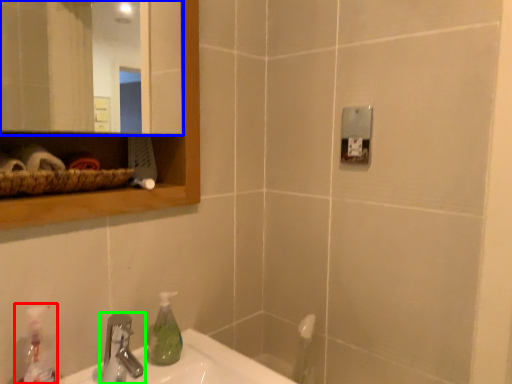
Question: Estimate the real-world distances between objects in this image. Which object is closer to cleaning product (highlighted by a red box), mirror (highlighted by a blue box) or tap (highlighted by a green box)?

Choices:
 (A) mirror
 (B) tap

Answer: (B)